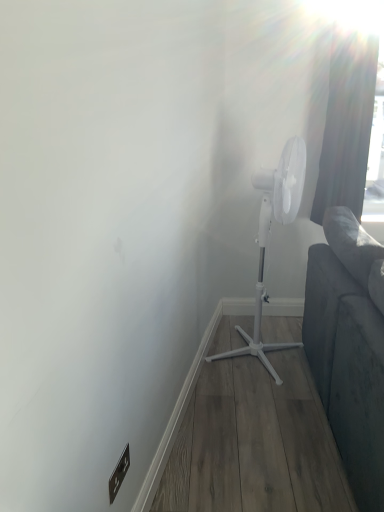
Question: Is white plastic mechanical fan at center to the left of brown matte electric outlet at lower left from the viewer's perspective?

Choices:
 (A) yes
 (B) no

Answer: (B)

Question: Could you tell me if white plastic mechanical fan at center is facing brown matte electric outlet at lower left?

Choices:
 (A) no
 (B) yes

Answer: (A)

Question: Does white plastic mechanical fan at center have a larger size compared to brown matte electric outlet at lower left?

Choices:
 (A) yes
 (B) no

Answer: (A)

Question: Would you say white plastic mechanical fan at center contains brown matte electric outlet at lower left?

Choices:
 (A) no
 (B) yes

Answer: (A)

Question: Is white plastic mechanical fan at center not inside brown matte electric outlet at lower left?

Choices:
 (A) yes
 (B) no

Answer: (A)

Question: Is white plastic mechanical fan at center looking in the opposite direction of brown matte electric outlet at lower left?

Choices:
 (A) yes
 (B) no

Answer: (B)

Question: Does white plastic mechanical fan at center come in front of dark gray fabric curtain at upper right?

Choices:
 (A) no
 (B) yes

Answer: (B)

Question: Is white plastic mechanical fan at center to the left of dark gray fabric curtain at upper right from the viewer's perspective?

Choices:
 (A) no
 (B) yes

Answer: (B)

Question: Can dark gray fabric curtain at upper right be found inside white plastic mechanical fan at center?

Choices:
 (A) yes
 (B) no

Answer: (B)

Question: From a real-world perspective, is white plastic mechanical fan at center physically above dark gray fabric curtain at upper right?

Choices:
 (A) no
 (B) yes

Answer: (A)

Question: Are white plastic mechanical fan at center and dark gray fabric curtain at upper right beside each other?

Choices:
 (A) no
 (B) yes

Answer: (A)

Question: Considering the relative sizes of white plastic mechanical fan at center and dark gray fabric curtain at upper right in the image provided, is white plastic mechanical fan at center shorter than dark gray fabric curtain at upper right?

Choices:
 (A) no
 (B) yes

Answer: (A)

Question: Can you confirm if brown matte electric outlet at lower left is wider than white plastic mechanical fan at center?

Choices:
 (A) no
 (B) yes

Answer: (A)